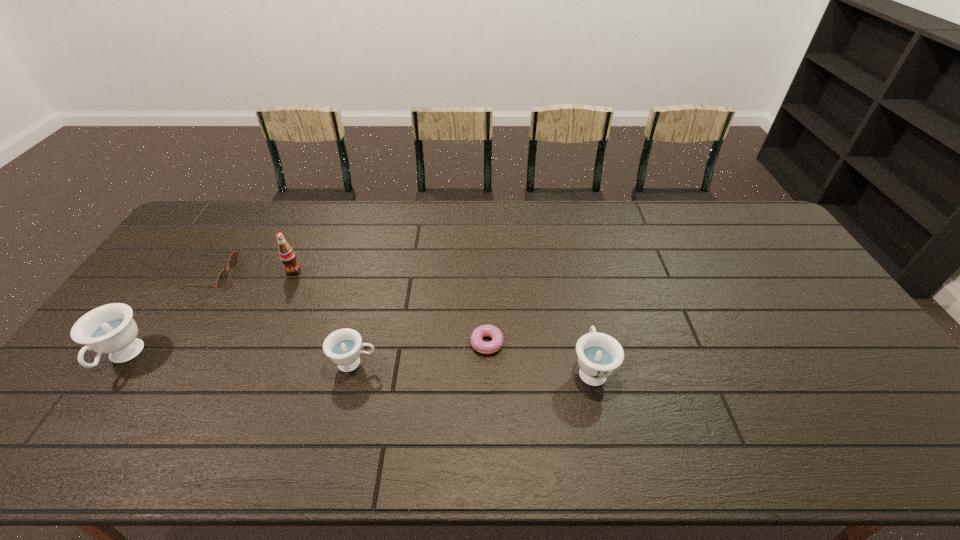
Where is `vacant area that lies between the fourth object from left to right and the leftmost teacup`? This screenshot has width=960, height=540. vacant area that lies between the fourth object from left to right and the leftmost teacup is located at coordinates (239, 360).

This screenshot has width=960, height=540. What are the coordinates of `blank region between the third object from left to right and the shortest object` in the screenshot? It's located at (389, 307).

Image resolution: width=960 pixels, height=540 pixels. In order to click on free space between the third object from right to left and the soda in this screenshot , I will do `click(324, 317)`.

Find the location of a particular element. The height and width of the screenshot is (540, 960). empty space that is in between the third object from left to right and the rightmost teacup is located at coordinates (443, 320).

Identify which object is the nearest to the leftmost teacup. Please provide its 2D coordinates. Your answer should be formatted as a tuple, i.e. [(x, y)], where the tuple contains the x and y coordinates of a point satisfying the conditions above.

[(222, 278)]

Select which object appears as the third closest to the sunglasses. Please provide its 2D coordinates. Your answer should be formatted as a tuple, i.e. [(x, y)], where the tuple contains the x and y coordinates of a point satisfying the conditions above.

[(343, 346)]

Locate which teacup ranks in proximity to the third object from left to right. Please provide its 2D coordinates. Your answer should be formatted as a tuple, i.e. [(x, y)], where the tuple contains the x and y coordinates of a point satisfying the conditions above.

[(343, 346)]

This screenshot has width=960, height=540. Find the location of `teacup identified as the closest to the second teacup from right to left`. teacup identified as the closest to the second teacup from right to left is located at coordinates (110, 329).

The width and height of the screenshot is (960, 540). I want to click on vacant space that satisfies the following two spatial constraints: 1. on the side of the second shortest teacup with the handle; 2. on the side of the third shortest object with the handle, so click(590, 363).

The width and height of the screenshot is (960, 540). Identify the location of free spot that satisfies the following two spatial constraints: 1. on the face of the shortest object; 2. on the left side of the fifth tallest object. (170, 343).